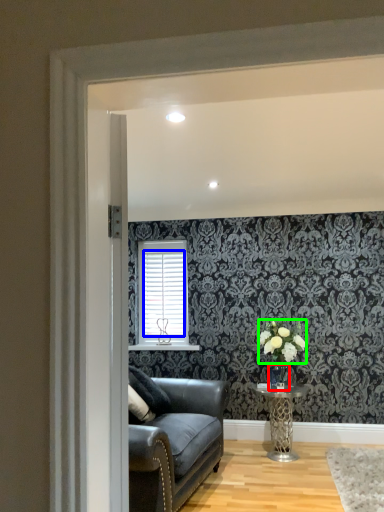
Question: Which object is positioned closest to glass vase (highlighted by a red box)? Select from blind (highlighted by a blue box) and flower (highlighted by a green box).

Choices:
 (A) blind
 (B) flower

Answer: (B)